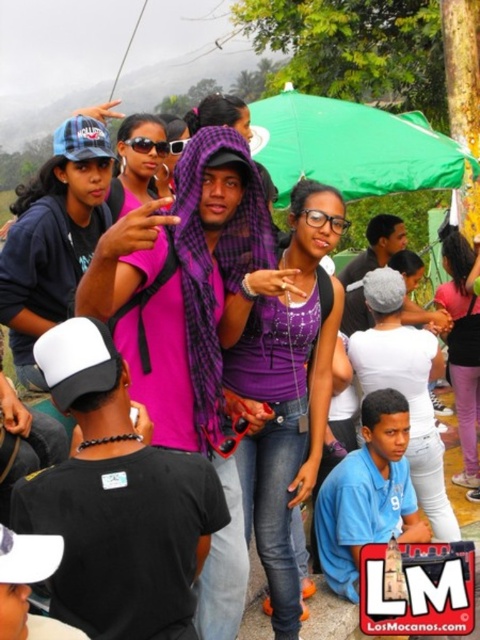
Is purple matte scarf at center to the left of green fabric umbrella at upper center from the viewer's perspective?

Correct, you'll find purple matte scarf at center to the left of green fabric umbrella at upper center.

What are the coordinates of `purple matte scarf at center` in the screenshot? It's located at (289, 392).

The height and width of the screenshot is (640, 480). Find the location of `purple matte scarf at center`. purple matte scarf at center is located at coordinates (289, 392).

Does green fabric umbrella at upper center have a lesser height compared to pink fabric scarf at center?

Indeed, green fabric umbrella at upper center has a lesser height compared to pink fabric scarf at center.

Does green fabric umbrella at upper center have a smaller size compared to pink fabric scarf at center?

Indeed, green fabric umbrella at upper center has a smaller size compared to pink fabric scarf at center.

The height and width of the screenshot is (640, 480). Identify the location of green fabric umbrella at upper center. (351, 147).

You are a GUI agent. You are given a task and a screenshot of the screen. Output one action in this format:
    pyautogui.click(x=<x>, y=<y>)
    Task: Click on the green fabric umbrella at upper center
    This screenshot has width=480, height=640.
    Given the screenshot: What is the action you would take?
    pyautogui.click(x=351, y=147)

Is purple matte scarf at center shorter than pink fabric scarf at center?

No, purple matte scarf at center is not shorter than pink fabric scarf at center.

Does purple matte scarf at center have a greater height compared to pink fabric scarf at center?

Indeed, purple matte scarf at center has a greater height compared to pink fabric scarf at center.

Which is behind, point (277, 442) or point (465, 276)?

Point (465, 276)

This screenshot has width=480, height=640. What are the coordinates of `purple matte scarf at center` in the screenshot? It's located at (289, 392).